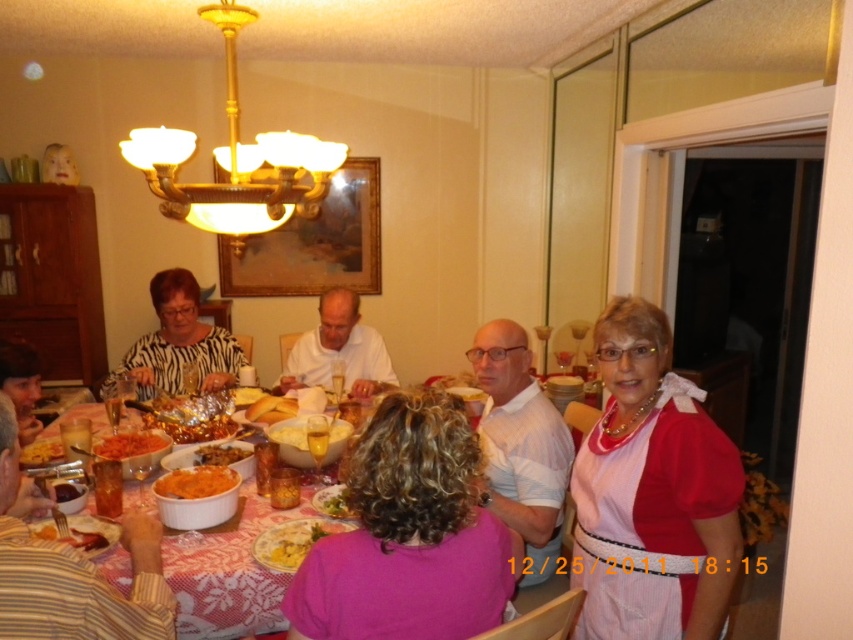
From the picture: Is zebra print blouse at center shorter than green leafy vegetable at center?

Incorrect, zebra print blouse at center's height does not fall short of green leafy vegetable at center's.

Does point (149, 292) come behind point (334, 516)?

Yes, it is behind point (334, 516).

Is point (187, 285) closer to camera compared to point (323, 502)?

No, it is not.

Identify the location of zebra print blouse at center. (177, 342).

Who is positioned more to the right, pink satin blouse at right or gold/metallic chandelier at upper center?

pink satin blouse at right

Can you confirm if pink satin blouse at right is smaller than gold/metallic chandelier at upper center?

Correct, pink satin blouse at right occupies less space than gold/metallic chandelier at upper center.

Image resolution: width=853 pixels, height=640 pixels. Describe the element at coordinates (653, 493) in the screenshot. I see `pink satin blouse at right` at that location.

At what (x,y) coordinates should I click in order to perform the action: click on pink satin blouse at right. Please return your answer as a coordinate pair (x, y). This screenshot has height=640, width=853. Looking at the image, I should click on (653, 493).

Which is more to the left, zebra print blouse at center or yellowish matte pasta at lower left?

yellowish matte pasta at lower left

Does zebra print blouse at center have a smaller size compared to yellowish matte pasta at lower left?

Actually, zebra print blouse at center might be larger than yellowish matte pasta at lower left.

Who is more distant from viewer, (213, 376) or (32, 465)?

Point (213, 376)

Identify the location of zebra print blouse at center. Image resolution: width=853 pixels, height=640 pixels. (177, 342).